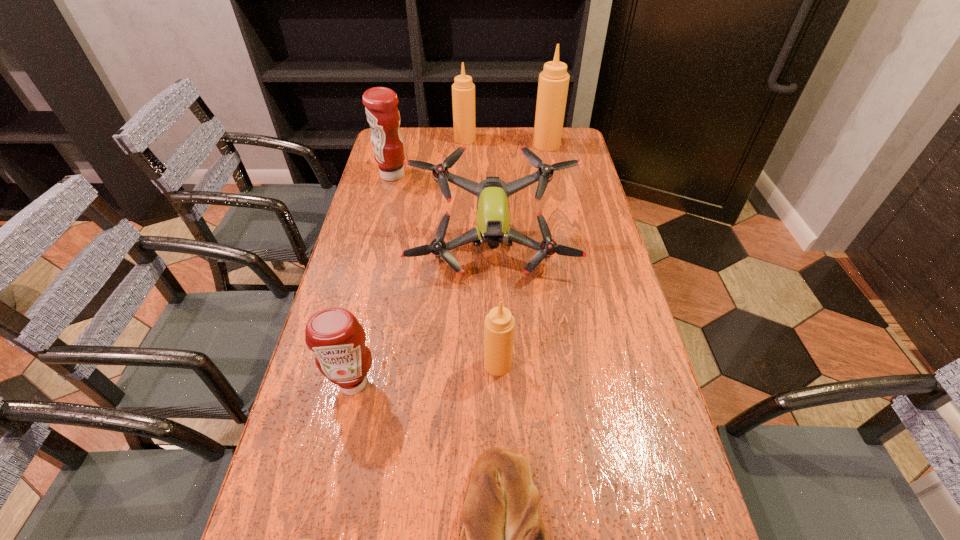
Where is `the nearer red condiment`? The width and height of the screenshot is (960, 540). the nearer red condiment is located at coordinates 334,335.

You are a GUI agent. You are given a task and a screenshot of the screen. Output one action in this format:
    pyautogui.click(x=<x>, y=<y>)
    Task: Click on the free space located on the back of the tallest condiment
    
    Given the screenshot: What is the action you would take?
    pyautogui.click(x=543, y=130)

At what (x,y) coordinates should I click in order to perform the action: click on vacant region located 0.270m on the front of the second smallest tan condiment. Please return your answer as a coordinate pair (x, y). The height and width of the screenshot is (540, 960). Looking at the image, I should click on (463, 184).

At what (x,y) coordinates should I click in order to perform the action: click on free space located 0.140m on the right of the sixth nearest object. Please return your answer as a coordinate pair (x, y). The height and width of the screenshot is (540, 960). Looking at the image, I should click on (447, 175).

The image size is (960, 540). What are the coordinates of `vacant area located 0.270m on the front-facing side of the fifth nearest object` in the screenshot? It's located at (495, 371).

Where is `vacant space situated 0.110m on the right of the fourth condiment from left to right`? This screenshot has width=960, height=540. vacant space situated 0.110m on the right of the fourth condiment from left to right is located at coordinates (558, 364).

Where is `free space located 0.130m on the right of the smaller red condiment`? This screenshot has height=540, width=960. free space located 0.130m on the right of the smaller red condiment is located at coordinates (435, 383).

Where is `condiment that is positioned at the right edge`? condiment that is positioned at the right edge is located at coordinates (553, 83).

In order to click on drone present at the right edge in this screenshot , I will do `click(493, 227)`.

Where is `object that is at the far right corner`? The width and height of the screenshot is (960, 540). object that is at the far right corner is located at coordinates (553, 83).